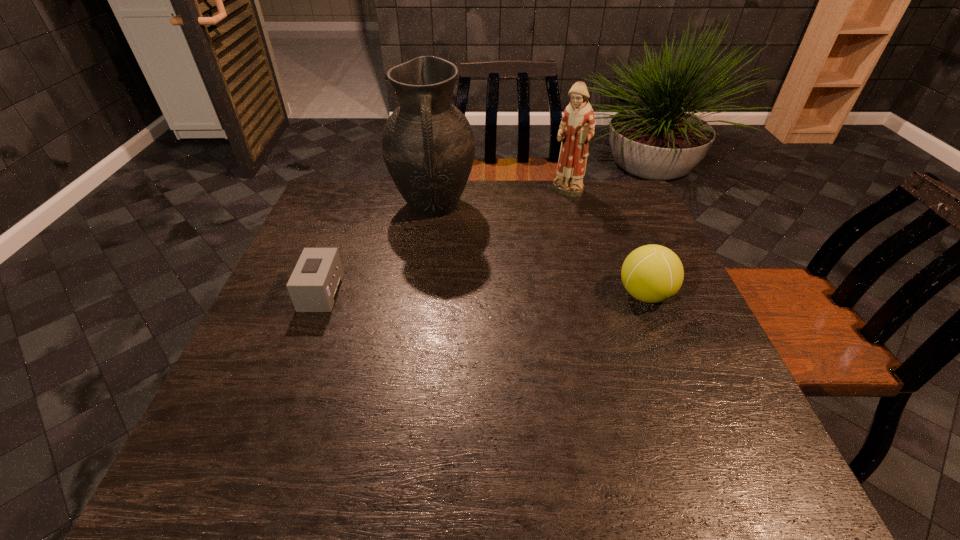
Where is `free region located on the side of the second object from left to right with the handle`? free region located on the side of the second object from left to right with the handle is located at coordinates (437, 273).

You are a GUI agent. You are given a task and a screenshot of the screen. Output one action in this format:
    pyautogui.click(x=<x>, y=<y>)
    Task: Click on the vacant area situated 0.350m on the side of the second object from left to right with the handle
    The image size is (960, 540).
    Given the screenshot: What is the action you would take?
    pyautogui.click(x=441, y=325)

Where is `vacant position located on the side of the second object from left to right with the handle`? This screenshot has width=960, height=540. vacant position located on the side of the second object from left to right with the handle is located at coordinates (438, 284).

Locate an element on the screen. The image size is (960, 540). figurine present at the far edge is located at coordinates (577, 126).

I want to click on pitcher that is at the far edge, so click(x=428, y=146).

Locate an element on the screen. The height and width of the screenshot is (540, 960). object at the left edge is located at coordinates (315, 282).

The image size is (960, 540). What are the coordinates of `object that is at the right edge` in the screenshot? It's located at (x=652, y=273).

What are the coordinates of `vacant space at the far edge of the desktop` in the screenshot? It's located at (567, 220).

Locate an element on the screen. The image size is (960, 540). vacant space at the near edge is located at coordinates (494, 428).

The width and height of the screenshot is (960, 540). In the image, there is a desktop. What are the coordinates of `vacant space at the left edge` in the screenshot? It's located at (288, 293).